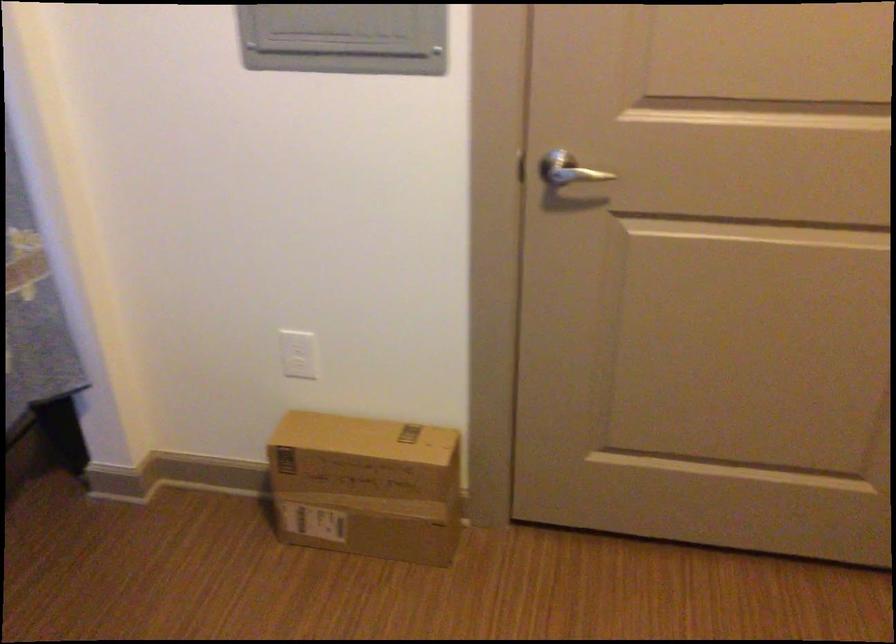
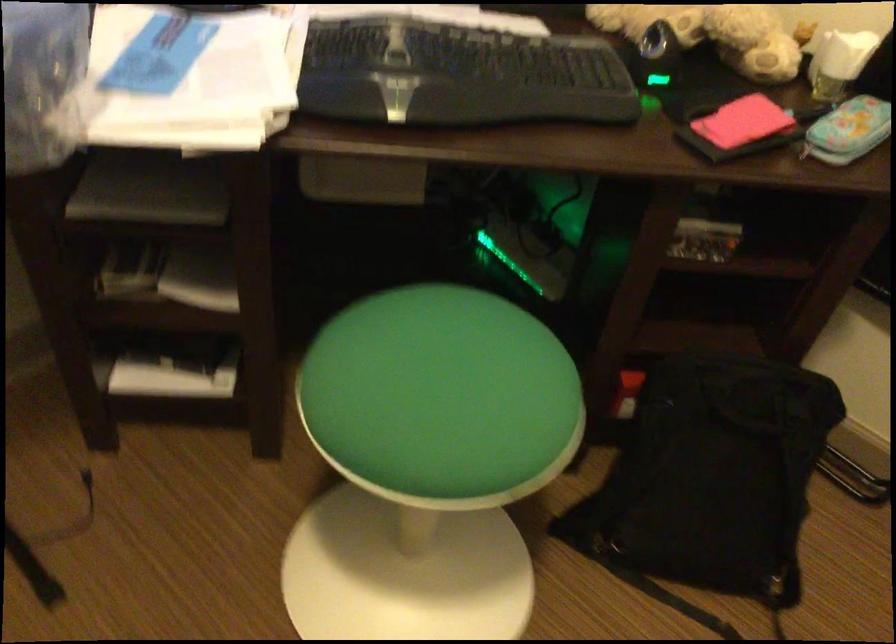
First-person continuous shooting, in which direction is the camera rotating?

The camera's rotation is toward left-down.